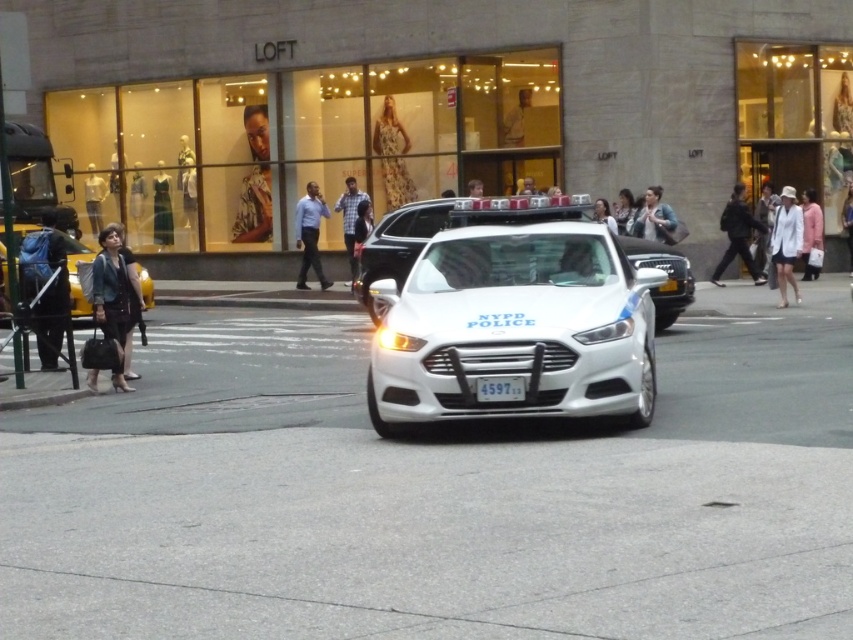
Question: Which object is positioned farthest from the blue shirt at center?

Choices:
 (A) white asphalt at center
 (B) white cotton dress at center

Answer: (A)

Question: Does matte blue jeans at center have a greater width compared to checkered fabric shirt at center?

Choices:
 (A) no
 (B) yes

Answer: (B)

Question: In this image, where is yellow plastic taxi at lower left located relative to green satin dress at upper center?

Choices:
 (A) below
 (B) above

Answer: (A)

Question: Which object is farther from the camera taking this photo?

Choices:
 (A) matte black dress at upper left
 (B) floral dress at center
 (C) yellow plastic taxi at lower left

Answer: (A)

Question: Does floral dress at center appear on the right side of black leather jacket at right?

Choices:
 (A) no
 (B) yes

Answer: (A)

Question: Which point is closer to the camera?

Choices:
 (A) white asphalt at center
 (B) light brown leather jacket at center
 (C) matte black backpack at left
 (D) blue shirt at center

Answer: (A)